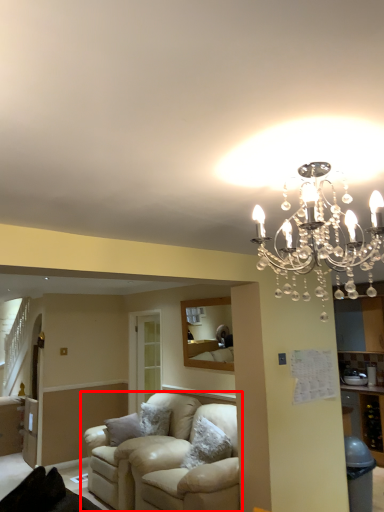
Question: From the image, what is the correct spatial relationship of studio couch (annotated by the red box) in relation to lamp?

Choices:
 (A) left
 (B) right

Answer: (A)